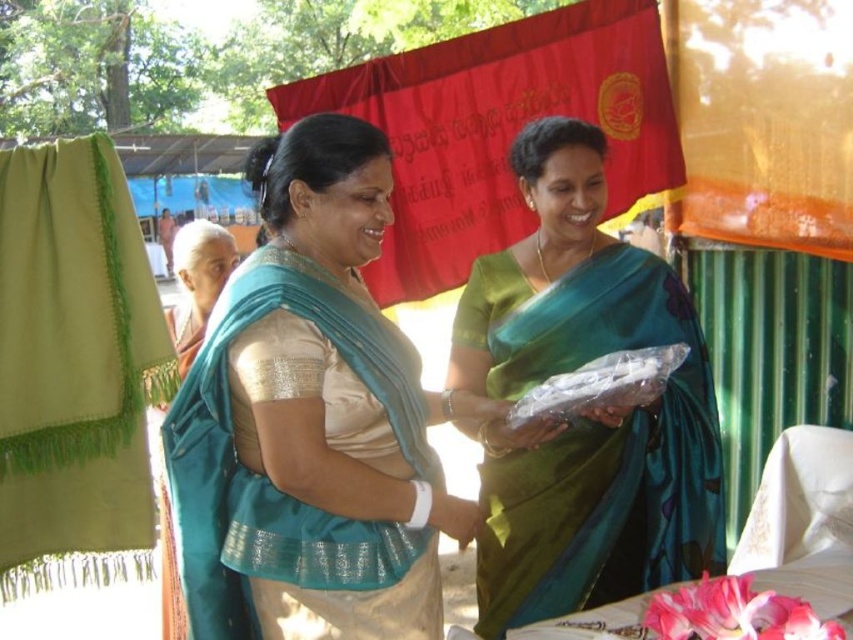
From the picture: You are attending a cultural event and see the teal silk saree at center and the translucent plastic food at center. Which object is nearer to you?

The teal silk saree at center is closer to the viewer than the translucent plastic food at center.

You are organizing a gift exchange event and need to determine which item is larger between the teal silk saree at center and the translucent plastic food at center. Based on the scene description, which one is larger?

Answer: The teal silk saree at center is bigger than the translucent plastic food at center, so the teal silk saree at center is larger.

You are organizing a cultural event and need to display two traditional garments. The teal silk saree at center and the green fabric at left are available. If you want to place them side by side on a display table, which garment should you place first to ensure both fit properly?

The teal silk saree at center has a greater width than the green fabric at left. Therefore, place the green fabric at left first, leaving enough space for the wider teal silk saree at center to fit alongside it.